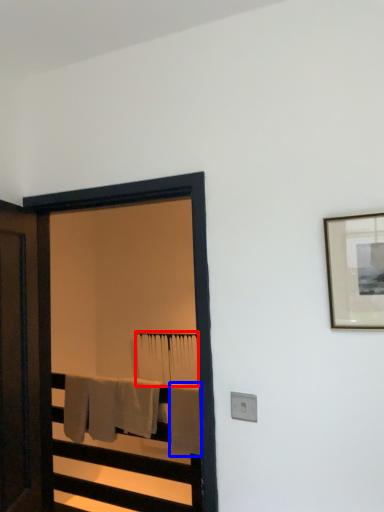
Question: Which point is closer to the camera, bath towel (highlighted by a red box) or bath towel (highlighted by a blue box)?

Choices:
 (A) bath towel
 (B) bath towel

Answer: (B)